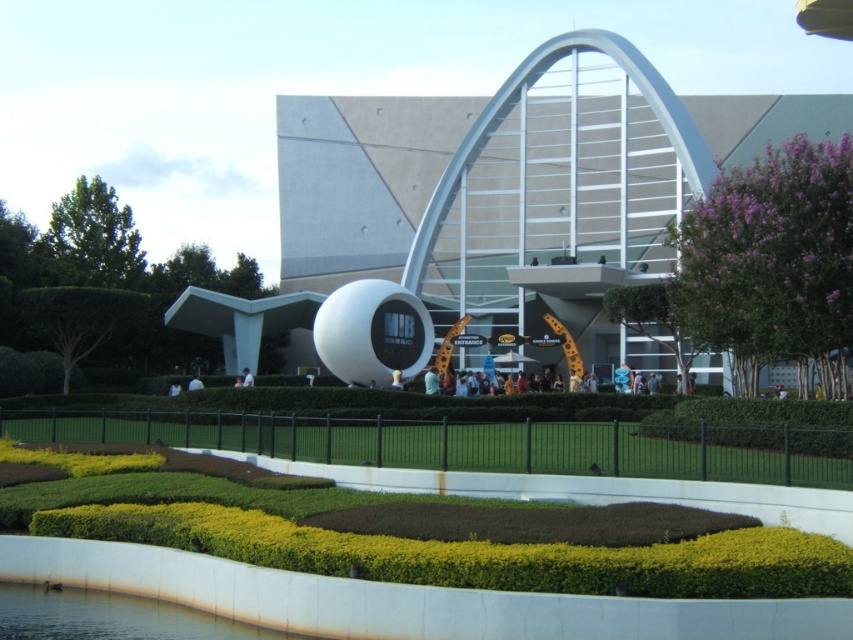
Consider the image. Measure the distance between white smooth sphere at center and camera.

white smooth sphere at center and camera are 56.74 meters apart from each other.

Is point (485, 124) in front of point (706, 198)?

No, it is behind (706, 198).

Does point (492, 160) come farther from viewer compared to point (715, 305)?

Yes.

The image size is (853, 640). In order to click on white smooth sphere at center in this screenshot , I will do `click(512, 214)`.